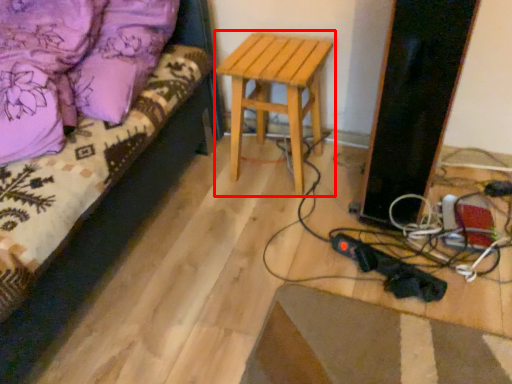
Question: From the image's perspective, considering the relative positions of stool (annotated by the red box) and furniture in the image provided, where is stool (annotated by the red box) located with respect to the staircase?

Choices:
 (A) above
 (B) below

Answer: (A)